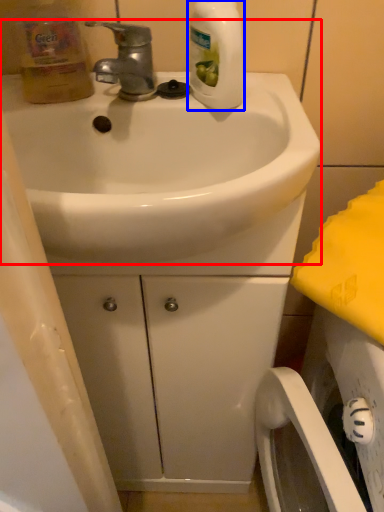
Question: Which object appears closest to the camera in this image, sink (highlighted by a red box) or cleaning product (highlighted by a blue box)?

Choices:
 (A) sink
 (B) cleaning product

Answer: (A)